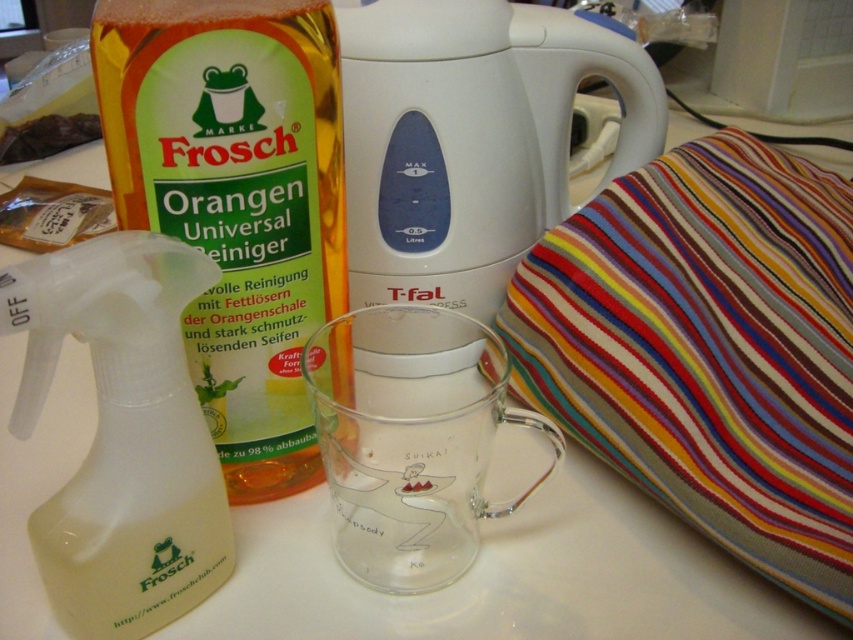
Question: Which object is farther from the camera taking this photo?

Choices:
 (A) transparent plastic spray bottle at left
 (B) striped fabric cushion at right
 (C) white plastic jug at center
 (D) yellow-orange liquid at left

Answer: (C)

Question: Is yellow-orange liquid at left above transparent plastic spray bottle at left?

Choices:
 (A) no
 (B) yes

Answer: (B)

Question: Which of the following is the closest to the observer?

Choices:
 (A) yellow-orange liquid at left
 (B) transparent plastic spray bottle at left
 (C) striped fabric cushion at right

Answer: (B)

Question: Observing the image, what is the correct spatial positioning of striped fabric cushion at right in reference to transparent plastic spray bottle at left?

Choices:
 (A) left
 (B) right

Answer: (B)

Question: Which point is closer to the camera?

Choices:
 (A) striped fabric cushion at right
 (B) white plastic jug at center
 (C) yellow-orange liquid at left

Answer: (C)

Question: Is white plastic jug at center below transparent plastic spray bottle at left?

Choices:
 (A) yes
 (B) no

Answer: (B)